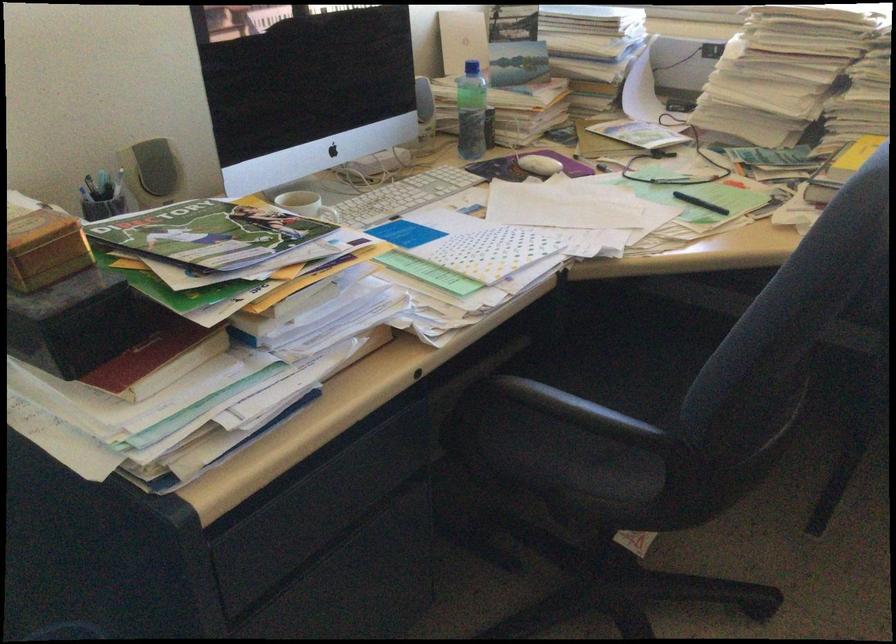
Describe the element at coordinates (300, 491) in the screenshot. I see `the black drawer pull` at that location.